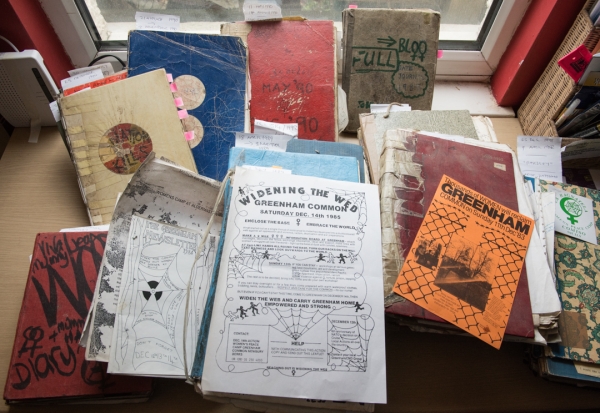
Find the location of a particular element. This screenshot has width=600, height=413. woven pen/pencil/supplies holder is located at coordinates (551, 100).